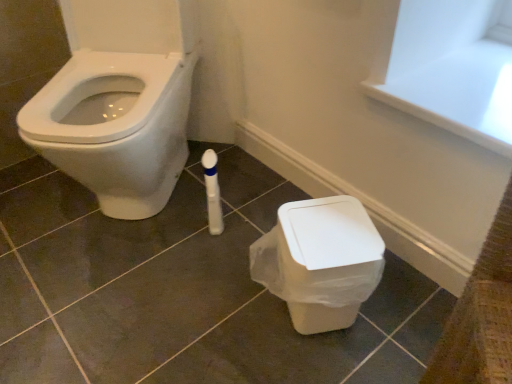
This screenshot has height=384, width=512. Find the location of `white plastic bin at lower right`. white plastic bin at lower right is located at coordinates (320, 261).

Based on the photo, can you tell me how much white glossy bidet at left and white plastic bin at lower right differ in facing direction?

69.6 degrees separate the facing orientations of white glossy bidet at left and white plastic bin at lower right.

Does white glossy bidet at left have a lesser height compared to white plastic bin at lower right?

No.

Find the location of a particular element. The height and width of the screenshot is (384, 512). bidet that appears above the white plastic bin at lower right (from a real-world perspective) is located at coordinates (116, 128).

Is point (101, 58) positioned behind point (322, 211)?

Yes, it is.

Would you say matte white tile at center is to the left or to the right of white glossy bidet at left in the picture?

Clearly, matte white tile at center is on the right of white glossy bidet at left in the image.

Is white glossy bidet at left located within matte white tile at center?

No, white glossy bidet at left is located outside of matte white tile at center.

From the image's perspective, is matte white tile at center on top of white glossy bidet at left?

Incorrect, from the image's perspective, matte white tile at center is lower than white glossy bidet at left.

Can you tell me how much matte white tile at center and white glossy bidet at left differ in facing direction?

49.9 degrees.

Is white glossy bidet at left surrounded by white plastic bin at lower right?

No, white glossy bidet at left is not inside white plastic bin at lower right.

Is white plastic bin at lower right facing towards white glossy bidet at left?

No, white plastic bin at lower right does not turn towards white glossy bidet at left.

Does white plastic bin at lower right have a greater width compared to white glossy bidet at left?

No.

From the picture: From a real-world perspective, is white plastic bin at lower right positioned over white glossy bidet at left based on gravity?

No.

Considering the relative sizes of white glossy bidet at left and matte white tile at center in the image provided, is white glossy bidet at left bigger than matte white tile at center?

Yes, white glossy bidet at left is bigger than matte white tile at center.

The height and width of the screenshot is (384, 512). I want to click on tile below the white glossy bidet at left (from a real-world perspective), so click(182, 291).

Is white glossy bidet at left oriented towards matte white tile at center?

No, white glossy bidet at left is not oriented towards matte white tile at center.

Which object is positioned more to the left, white glossy bidet at left or matte white tile at center?

white glossy bidet at left is more to the left.

Which is more to the left, matte white tile at center or white plastic bin at lower right?

Result: Positioned to the left is matte white tile at center.

Does matte white tile at center have a smaller size compared to white plastic bin at lower right?

Actually, matte white tile at center might be larger than white plastic bin at lower right.

The height and width of the screenshot is (384, 512). I want to click on tile lying above the white plastic bin at lower right (from the image's perspective), so click(182, 291).

In terms of width, does matte white tile at center look wider or thinner when compared to white plastic bin at lower right?

matte white tile at center is wider than white plastic bin at lower right.

Which is nearer, [343,206] or [223,320]?

Clearly, point [343,206] is closer to the camera than point [223,320].

How different are the orientations of white plastic bin at lower right and matte white tile at center in degrees?

The facing directions of white plastic bin at lower right and matte white tile at center are 119 degrees apart.

From a real-world perspective, which object rests below the other?

matte white tile at center, from a real-world perspective.

Is white plastic bin at lower right at the right side of matte white tile at center?

Indeed, white plastic bin at lower right is positioned on the right side of matte white tile at center.

The width and height of the screenshot is (512, 384). What are the coordinates of `toilet behind the white glossy bidet at left` in the screenshot? It's located at (320, 261).

This screenshot has height=384, width=512. I want to click on tile below the white glossy bidet at left (from a real-world perspective), so click(182, 291).

Looking at this image, from the image, which object appears to be farther from white plastic bin at lower right, matte white tile at center or white glossy bidet at left?

white glossy bidet at left is further to white plastic bin at lower right.

Looking at the image, which one is located closer to matte white tile at center, white glossy bidet at left or white plastic bin at lower right?

white plastic bin at lower right lies closer to matte white tile at center than the other object.

Based on their spatial positions, is white glossy bidet at left or matte white tile at center further from white plastic bin at lower right?

white glossy bidet at left is further to white plastic bin at lower right.

Looking at the image, which one is located closer to white glossy bidet at left, matte white tile at center or white plastic bin at lower right?

matte white tile at center is closer to white glossy bidet at left.

From the image, which object appears to be nearer to matte white tile at center, white plastic bin at lower right or white glossy bidet at left?

white plastic bin at lower right is positioned closer to the anchor matte white tile at center.

When comparing their distances from white glossy bidet at left, does white plastic bin at lower right or matte white tile at center seem closer?

matte white tile at center is positioned closer to the anchor white glossy bidet at left.

Locate an element on the screen. tile situated between white glossy bidet at left and white plastic bin at lower right from left to right is located at coordinates (182, 291).